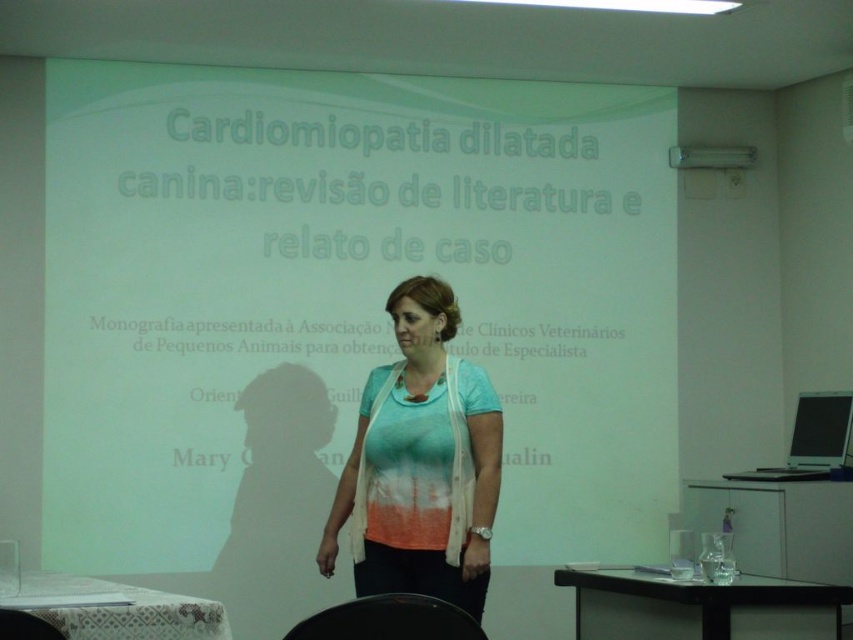
You are an attendee at this presentation and want to take a photo of the screen. Your camera can only capture objects up to 2 meters in height. The light blue cotton shirt at center is 1.7 meters tall. Can the white matte projection screen at center fit entirely within your camera frame?

The white matte projection screen at center is taller than the light blue cotton shirt at center, which is 1.7 meters tall. Since the screen is taller than 1.7 meters and the camera can only capture up to 2 meters, it depends on the exact height of the screen. If the screen is between 1.7 and 2 meters tall, it will fit. If it exceeds 2 meters, it won not fit. However, without the exact measurement, we cannot be certain.